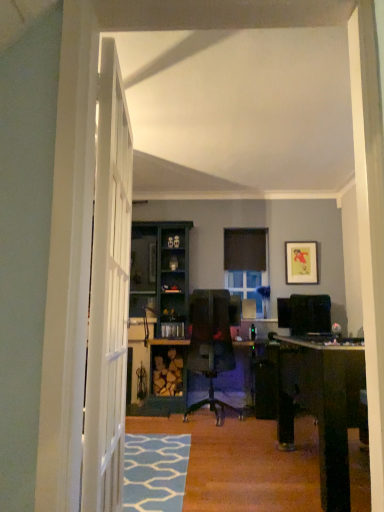
Question: Does clear glass window at center have a smaller size compared to black matte curtain at center?

Choices:
 (A) yes
 (B) no

Answer: (B)

Question: Does clear glass window at center have a lesser height compared to black matte curtain at center?

Choices:
 (A) yes
 (B) no

Answer: (B)

Question: Is clear glass window at center taller than black matte curtain at center?

Choices:
 (A) yes
 (B) no

Answer: (A)

Question: Considering the relative positions of clear glass window at center and black matte curtain at center in the image provided, is clear glass window at center behind black matte curtain at center?

Choices:
 (A) no
 (B) yes

Answer: (A)

Question: Is clear glass window at center oriented away from black matte curtain at center?

Choices:
 (A) yes
 (B) no

Answer: (B)

Question: In terms of height, does yellow paper picture frame at upper right look taller or shorter compared to black matte curtain at center?

Choices:
 (A) tall
 (B) short

Answer: (A)

Question: Considering the positions of point (291, 276) and point (233, 262), is point (291, 276) closer or farther from the camera than point (233, 262)?

Choices:
 (A) closer
 (B) farther

Answer: (A)

Question: In terms of width, does yellow paper picture frame at upper right look wider or thinner when compared to black matte curtain at center?

Choices:
 (A) wide
 (B) thin

Answer: (B)

Question: Would you say yellow paper picture frame at upper right is to the left or to the right of black matte curtain at center in the picture?

Choices:
 (A) right
 (B) left

Answer: (A)

Question: Is clear glass window at center situated inside yellow paper picture frame at upper right or outside?

Choices:
 (A) outside
 (B) inside

Answer: (A)

Question: Would you say clear glass window at center is to the left or to the right of yellow paper picture frame at upper right in the picture?

Choices:
 (A) right
 (B) left

Answer: (B)

Question: From the image's perspective, is clear glass window at center positioned above or below yellow paper picture frame at upper right?

Choices:
 (A) above
 (B) below

Answer: (B)

Question: Does point (241, 281) appear closer or farther from the camera than point (294, 248)?

Choices:
 (A) closer
 (B) farther

Answer: (B)

Question: Is yellow paper picture frame at upper right bigger or smaller than clear glass window at center?

Choices:
 (A) big
 (B) small

Answer: (B)

Question: Considering the positions of yellow paper picture frame at upper right and clear glass window at center in the image, is yellow paper picture frame at upper right taller or shorter than clear glass window at center?

Choices:
 (A) tall
 (B) short

Answer: (B)